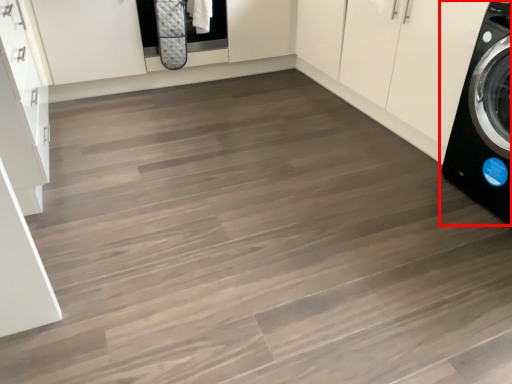
Question: From the image's perspective, what is the correct spatial relationship of washing machine (annotated by the red box) in relation to cabinetry?

Choices:
 (A) below
 (B) above

Answer: (A)